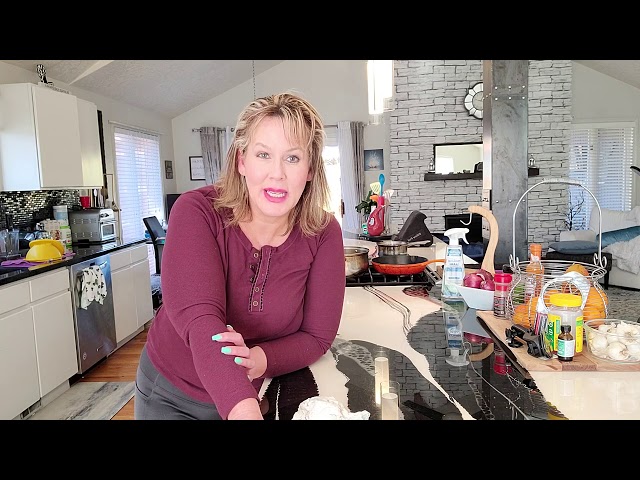
You are a GUI agent. You are given a task and a screenshot of the screen. Output one action in this format:
    pyautogui.click(x=<x>, y=<y>)
    Task: Click on the kitchen cabinets
    
    Given the screenshot: What is the action you would take?
    pyautogui.click(x=22, y=342), pyautogui.click(x=48, y=339), pyautogui.click(x=125, y=320), pyautogui.click(x=141, y=296)